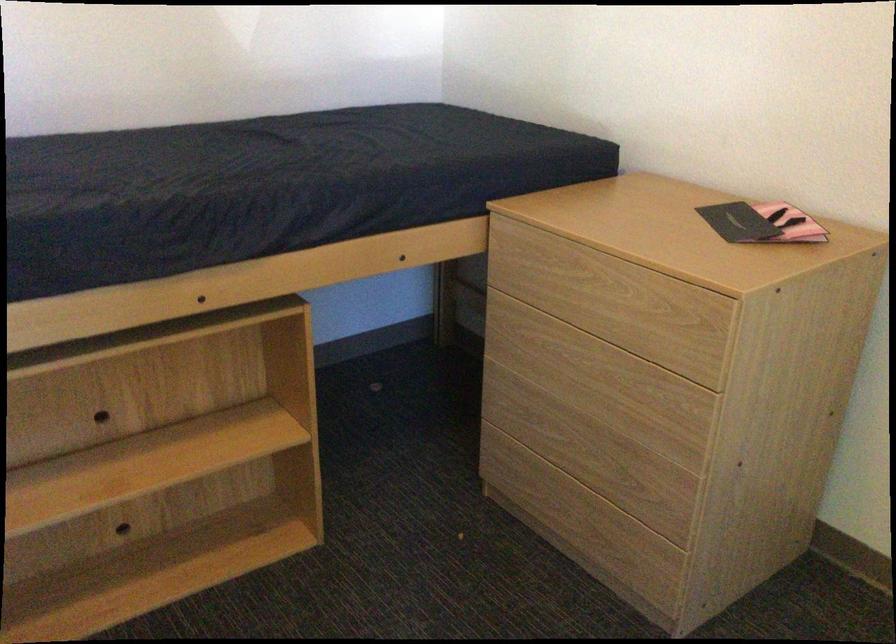
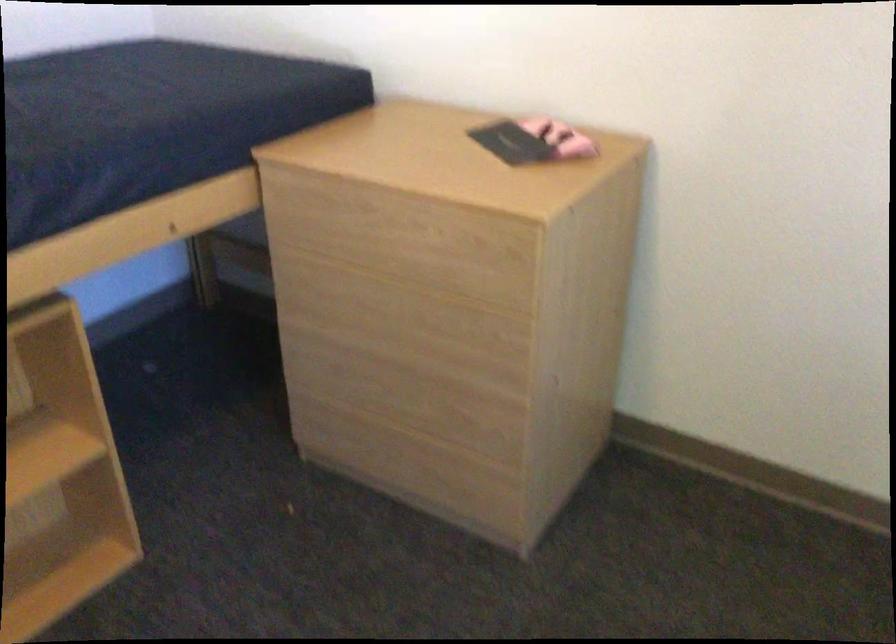
In the second image, find the point that corresponds to point (535, 260) in the first image.

(324, 209)